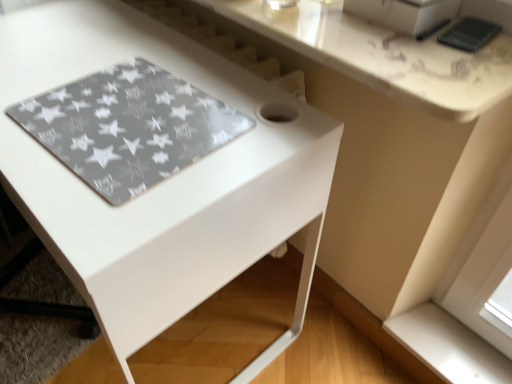
Identify the location of free space in front of transparent star-patterned mat at lower left. This screenshot has width=512, height=384. (106, 205).